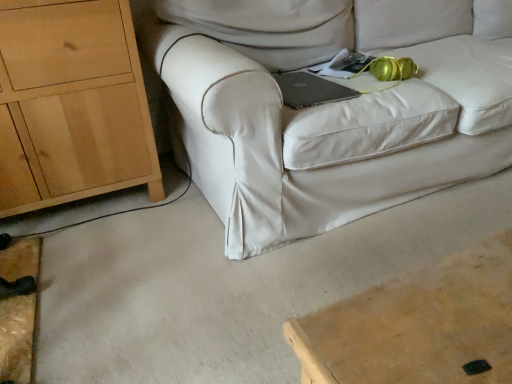
In order to face white fabric couch at center, should I rotate leftwards or rightwards?

Rotate your view right by about 23.064°.

What do you see at coordinates (332, 107) in the screenshot? I see `white fabric couch at center` at bounding box center [332, 107].

In order to click on white fabric couch at center in this screenshot , I will do `click(332, 107)`.

Identify the location of white fabric couch at center. The height and width of the screenshot is (384, 512). (332, 107).